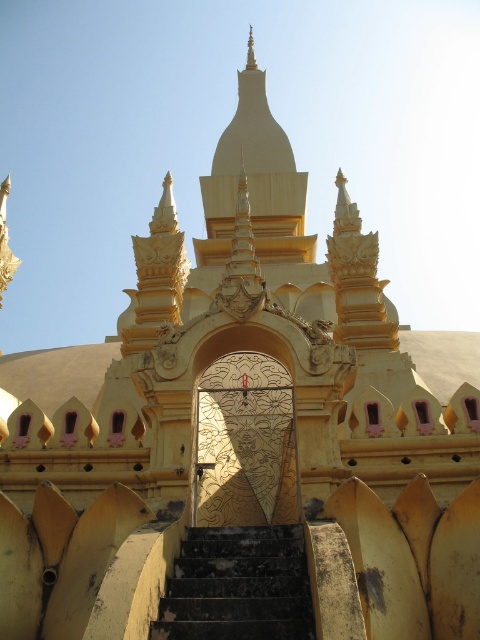
Question: Considering the relative positions of gold textured door at center and black stone stairs at center in the image provided, where is gold textured door at center located with respect to black stone stairs at center?

Choices:
 (A) above
 (B) below

Answer: (A)

Question: Which point appears closest to the camera in this image?

Choices:
 (A) (251, 404)
 (B) (232, 556)

Answer: (B)

Question: Can you confirm if gold textured door at center is positioned above black stone stairs at center?

Choices:
 (A) yes
 (B) no

Answer: (A)

Question: Which of the following is the farthest from the observer?

Choices:
 (A) gold textured door at center
 (B) black stone stairs at center

Answer: (A)

Question: Is the position of gold textured door at center less distant than that of black stone stairs at center?

Choices:
 (A) yes
 (B) no

Answer: (B)